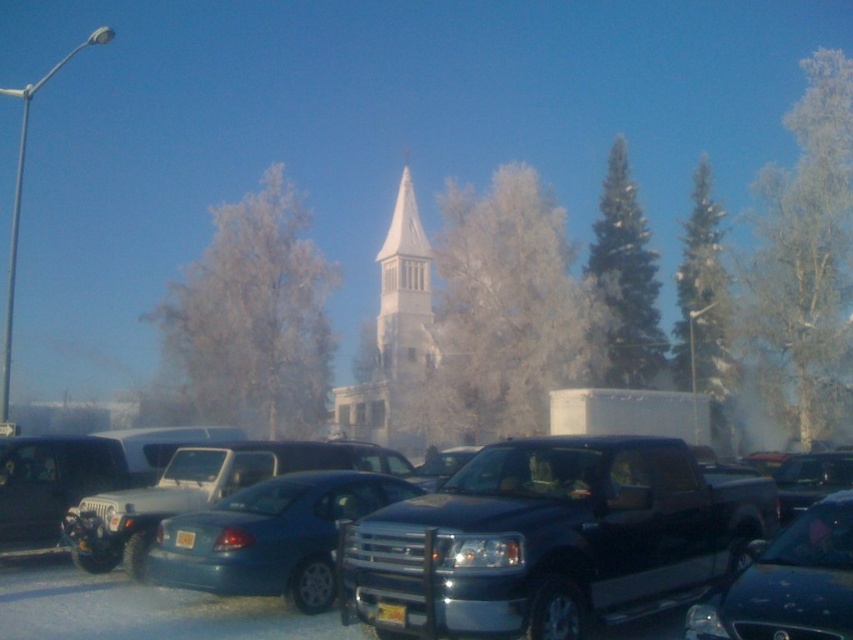
You are standing in the parking lot and see the metallic blue sedan at center and the shiny black sedan at center. Which one is positioned to the left?

The metallic blue sedan at center is positioned to the left of the shiny black sedan at center.

You are standing in the parking lot and want to take a photo of the church. You have two vehicles in front of you, the shiny black truck at center and the blue metallic sedan at center. Which vehicle should you position yourself behind to ensure the church is fully visible without obstruction?

You should position yourself behind the shiny black truck at center because it is closer to the viewer than the blue metallic sedan at center, meaning the sedan is further back and would block the view of the church.